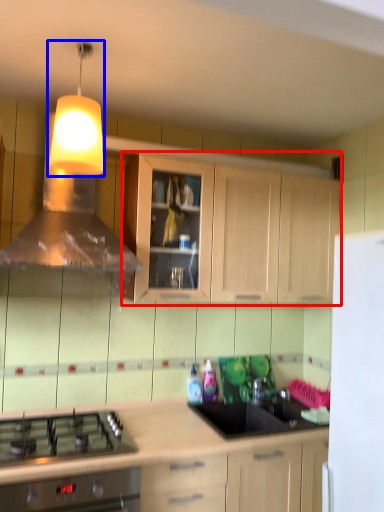
Question: Among these objects, which one is nearest to the camera, cabinetry (highlighted by a red box) or light fixture (highlighted by a blue box)?

Choices:
 (A) cabinetry
 (B) light fixture

Answer: (B)